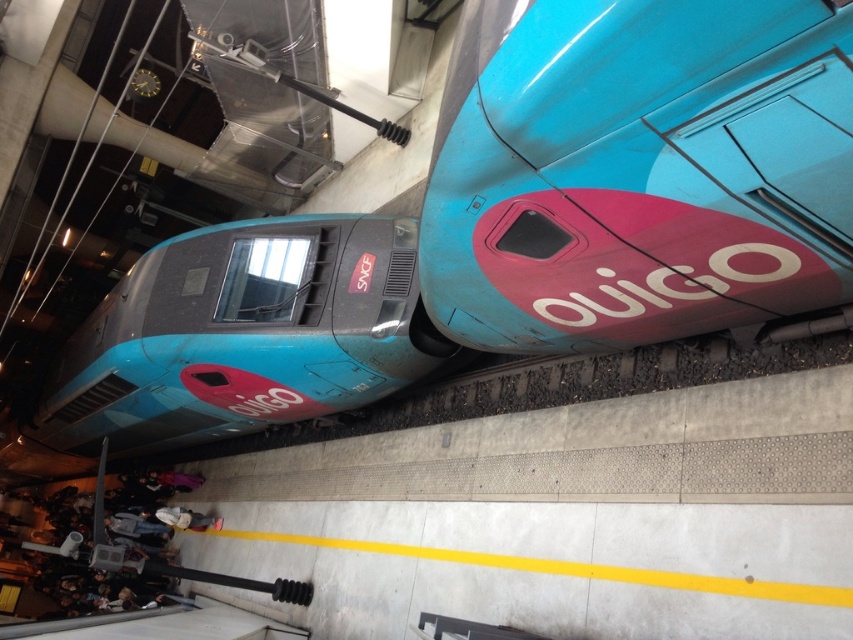
Question: Among these points, which one is nearest to the camera?

Choices:
 (A) (175, 273)
 (B) (834, 76)

Answer: (B)

Question: Which object is farther from the camera taking this photo?

Choices:
 (A) shiny blue train at upper right
 (B) matte blue train at center

Answer: (B)

Question: Is shiny blue train at upper right positioned in front of matte blue train at center?

Choices:
 (A) yes
 (B) no

Answer: (A)

Question: Does shiny blue train at upper right have a lesser width compared to matte blue train at center?

Choices:
 (A) no
 (B) yes

Answer: (A)

Question: Does shiny blue train at upper right lie behind matte blue train at center?

Choices:
 (A) yes
 (B) no

Answer: (B)